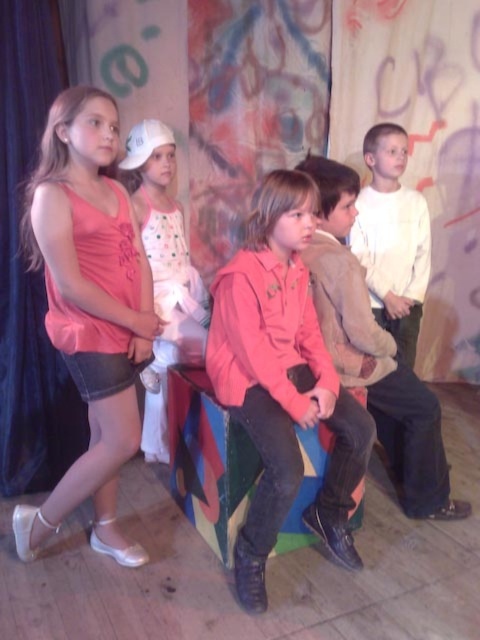
You are standing at the origin of the coordinate system in the image. There are two points marked in the scene. Which point, point (111, 371) or point (427, 280), is closer to you?

Point (111, 371) is in front of point (427, 280), so it is closer to you.

You are a costume designer preparing for a play. You need to determine which costume takes up more space in the wardrobe. Based on the image, which one is bigger between the pink fabric dress at left and the white matte shirt at upper right?

The pink fabric dress at left has a larger size compared to the white matte shirt at upper right, so the pink fabric dress at left takes up more space in the wardrobe.